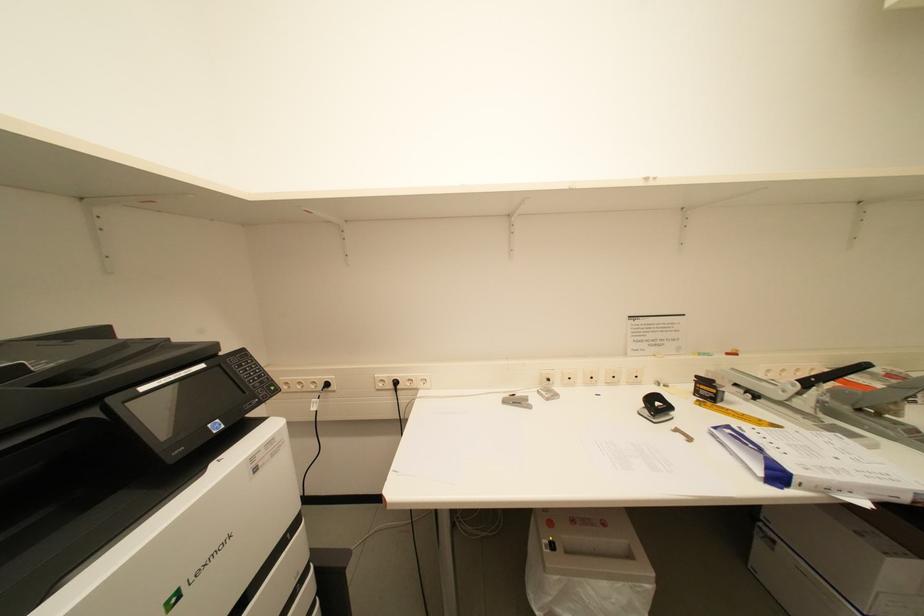
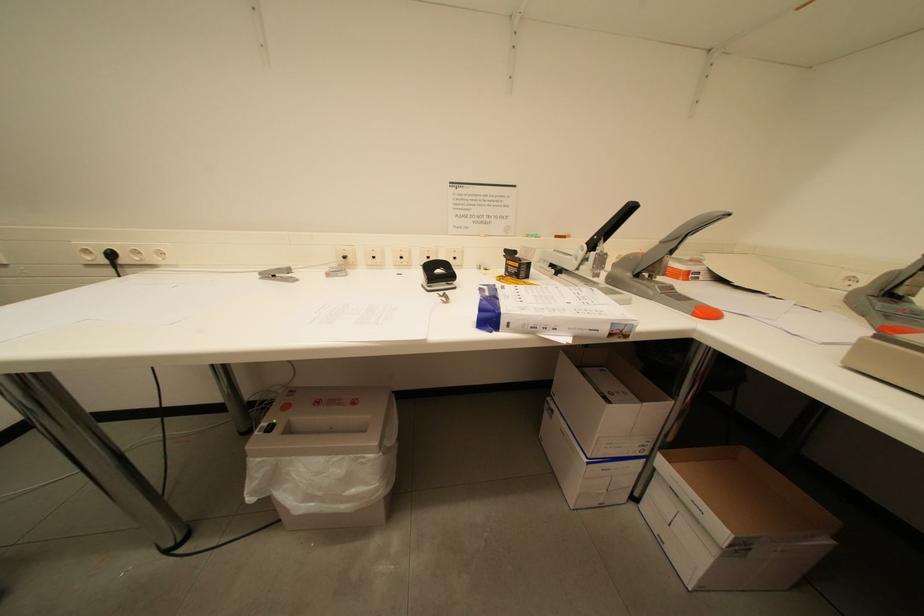
Question: Based on the continuous images, in which direction is the camera rotating? Reply with the corresponding letter.

Choices:
 (A) Left
 (B) Right
 (C) Up
 (D) Down

Answer: (D)